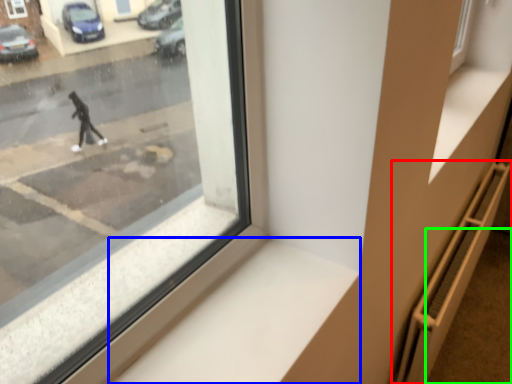
Question: Based on their relative distances, which object is nearer to stairwell (highlighted by a red box)? Choose from window sill (highlighted by a blue box) and pavement (highlighted by a green box).

Choices:
 (A) window sill
 (B) pavement

Answer: (B)